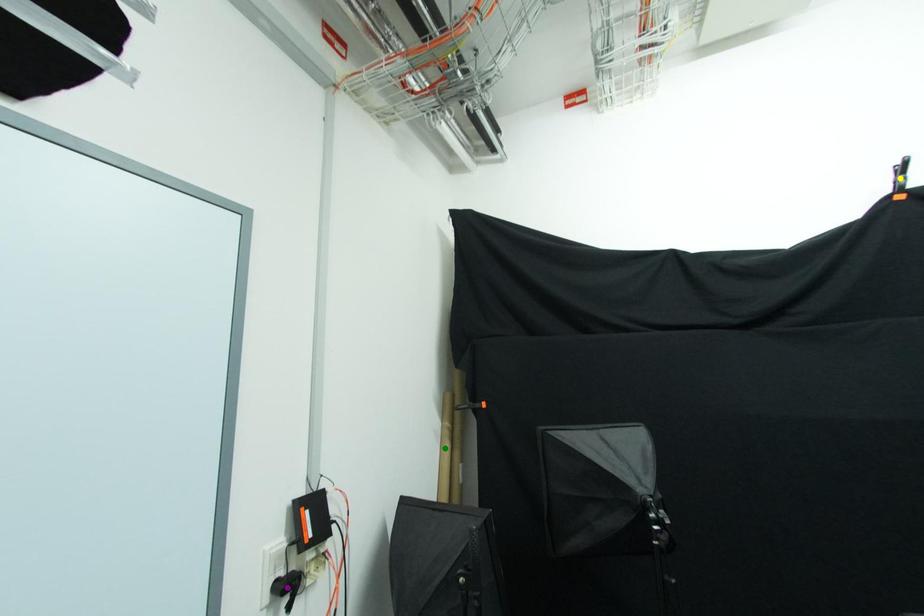
Order these from nearest to farthest:
yellow point | purple point | green point

green point
yellow point
purple point